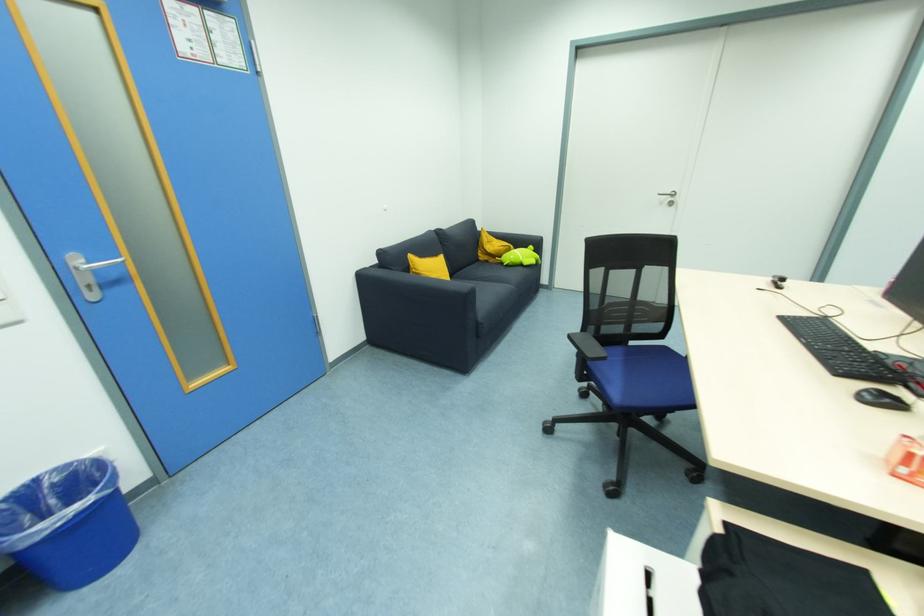
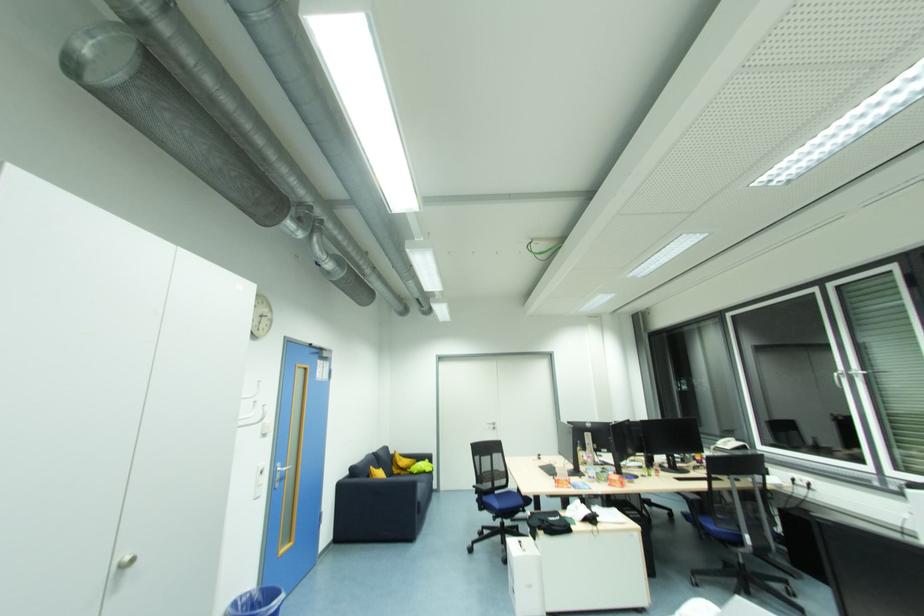
Where in the second image is the point corresponding to pixel 669 270 from the first image?

(504, 456)